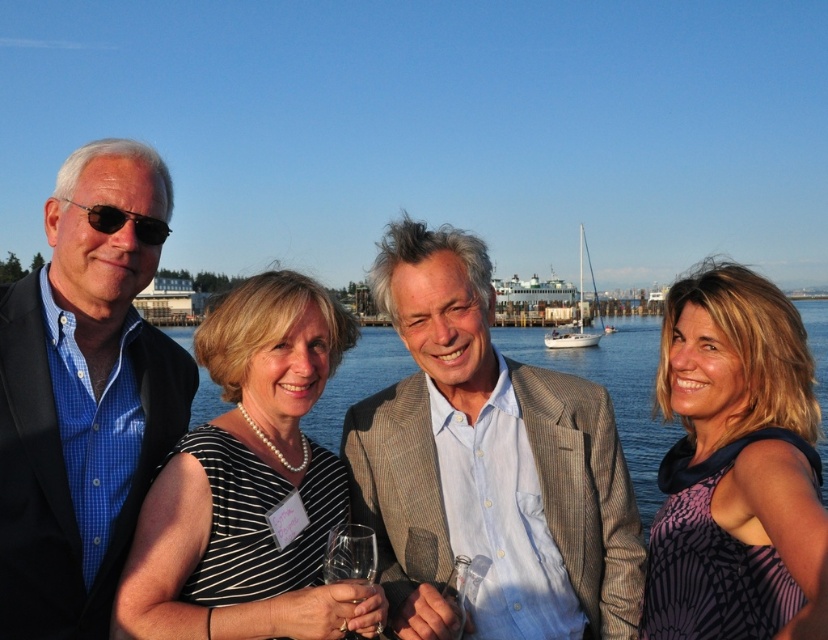
Is point (595, 422) behind point (263, 428)?

Yes, it is behind point (263, 428).

In order to click on light brown textured blazer at center in this screenshot , I will do `click(487, 464)`.

Does point (619, 428) come behind point (354, 564)?

Yes, it is behind point (354, 564).

Can you confirm if clear blue water at center is smaller than clear glass wine glass at center?

Incorrect, clear blue water at center is not smaller in size than clear glass wine glass at center.

Image resolution: width=828 pixels, height=640 pixels. In order to click on clear blue water at center in this screenshot , I will do `click(614, 392)`.

Where is `clear blue water at center`? The height and width of the screenshot is (640, 828). clear blue water at center is located at coordinates (614, 392).

Is light brown textured blazer at center to the right of clear glass wine glass at center from the viewer's perspective?

Correct, you'll find light brown textured blazer at center to the right of clear glass wine glass at center.

Is light brown textured blazer at center positioned in front of clear glass wine glass at center?

Yes, light brown textured blazer at center is in front of clear glass wine glass at center.

This screenshot has height=640, width=828. What do you see at coordinates (487, 464) in the screenshot?
I see `light brown textured blazer at center` at bounding box center [487, 464].

Where is `light brown textured blazer at center`? Image resolution: width=828 pixels, height=640 pixels. light brown textured blazer at center is located at coordinates (487, 464).